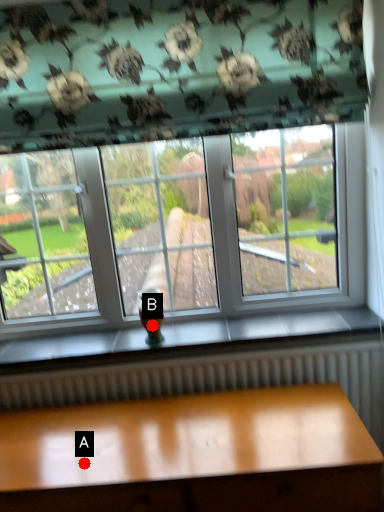
Question: Two points are circled on the image, labeled by A and B beside each circle. Which of the following is the closest to the observer?

Choices:
 (A) A is closer
 (B) B is closer

Answer: (A)